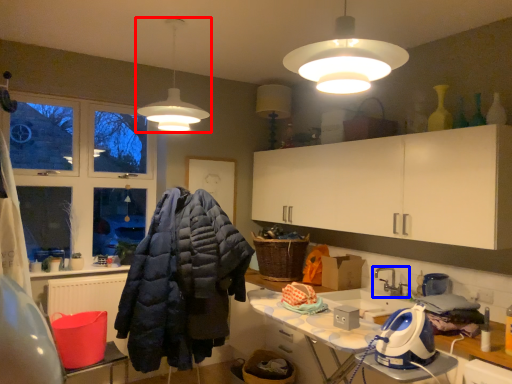
Question: Among these objects, which one is nearest to the camera, lamp (highlighted by a red box) or tap (highlighted by a blue box)?

Choices:
 (A) lamp
 (B) tap

Answer: (A)